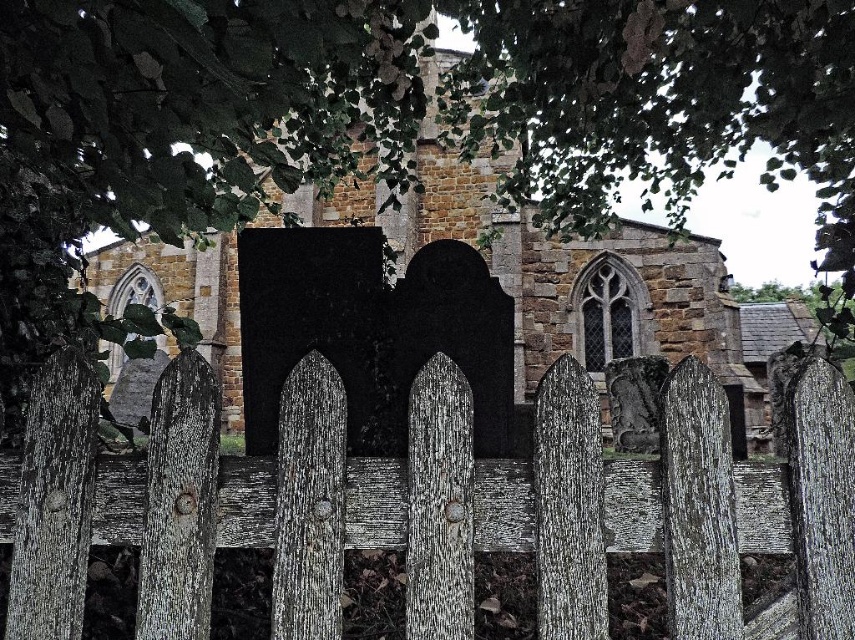
Does weathered wood fence at center appear on the left side of stone church at center?

Incorrect, weathered wood fence at center is not on the left side of stone church at center.

Does point (603, 586) come in front of point (443, 177)?

Yes, it is.

Which is in front, point (40, 476) or point (606, 358)?

Positioned in front is point (40, 476).

The width and height of the screenshot is (855, 640). Identify the location of weathered wood fence at center. (428, 504).